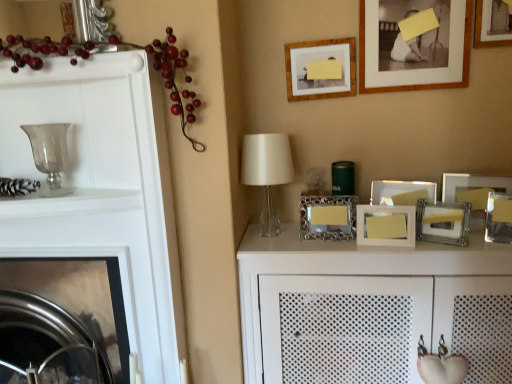
This screenshot has height=384, width=512. In order to click on vacant space in front of silver metallic photo frame at center, marked as the second picture frame in a bottom-to-top arrangement in this screenshot , I will do `click(457, 252)`.